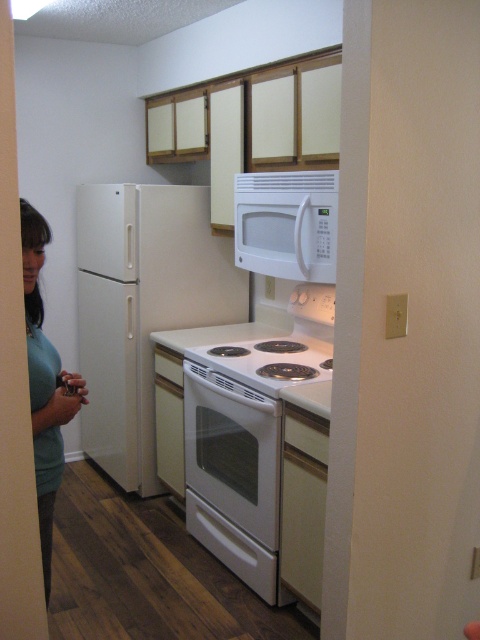
You are standing in the doorway of the kitchen and notice both the white glossy refrigerator at left and the green matte shirt at lower left. Which object is closer to you?

The green matte shirt at lower left is behind the white glossy refrigerator at left, so the white glossy refrigerator at left is closer to you.

You are organizing a dinner party and need to place a large platter on the kitchen counter. The platter is 30 cm wide. You see the white matte microwave at upper center and the white glossy stove at center. Which appliance has enough space to accommodate the platter without overlapping?

The white glossy stove at center has a greater width than the white matte microwave at upper center, so it can accommodate the 30 cm wide platter without overlapping.

You are standing in the doorway of the kitchen. You notice a point marked at coordinates [45,385]. What object is located at that point?

The point at coordinates [45,385] marks the green matte shirt at lower left.